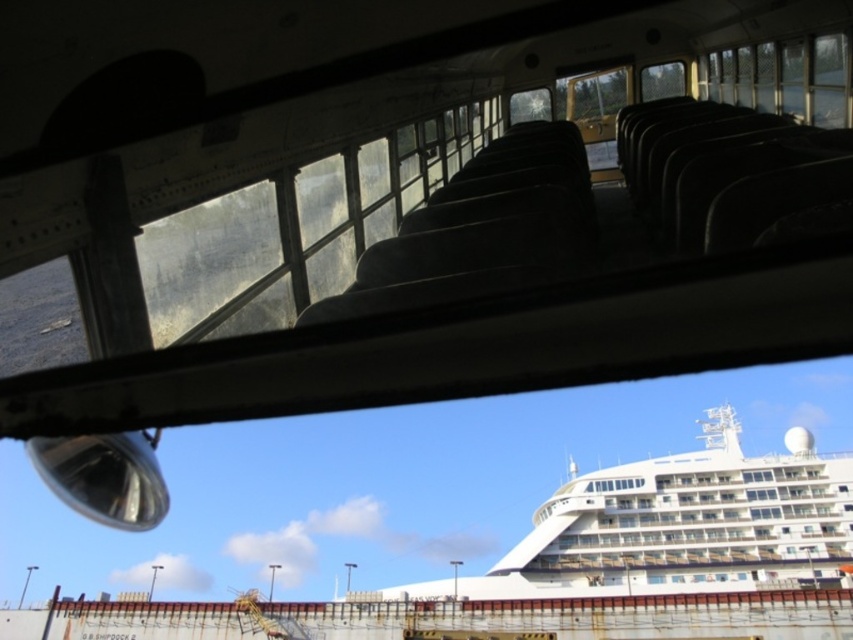
Question: From the image, what is the correct spatial relationship of white glossy cruise ship at center in relation to transparent plastic view mirror at lower left?

Choices:
 (A) right
 (B) left

Answer: (A)

Question: Which point is closer to the camera?

Choices:
 (A) transparent plastic view mirror at lower left
 (B) white glossy cruise ship at center

Answer: (A)

Question: Which point is closer to the camera?

Choices:
 (A) (792, 541)
 (B) (62, 468)

Answer: (B)

Question: From the image, what is the correct spatial relationship of white glossy cruise ship at center in relation to transparent plastic view mirror at lower left?

Choices:
 (A) above
 (B) below

Answer: (B)

Question: Can you confirm if white glossy cruise ship at center is positioned below transparent plastic view mirror at lower left?

Choices:
 (A) yes
 (B) no

Answer: (A)

Question: Which object appears farthest from the camera in this image?

Choices:
 (A) transparent plastic view mirror at lower left
 (B) white glossy cruise ship at center

Answer: (B)